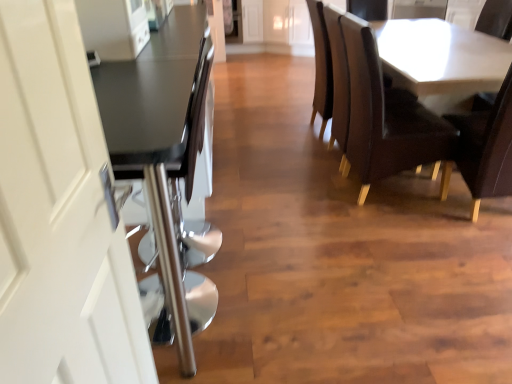
I want to click on vacant space to the left of leather armchair at center, so click(282, 131).